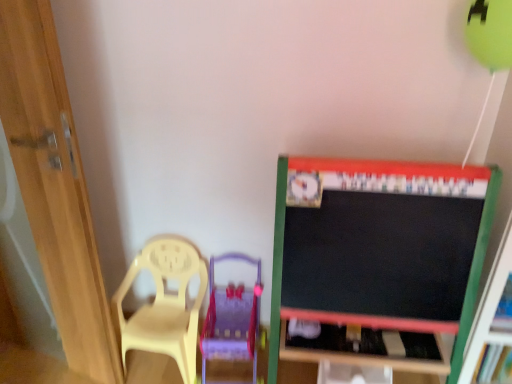
Question: From the image's perspective, relative to wooden door at left, is wooden table at lower center above or below?

Choices:
 (A) below
 (B) above

Answer: (A)

Question: Is wooden table at lower center wider or thinner than wooden door at left?

Choices:
 (A) thin
 (B) wide

Answer: (B)

Question: Which object is the closest to the wooden door at left?

Choices:
 (A) translucent yellow swivel chair at lower left
 (B) yellow plastic chair at left
 (C) wooden table at lower center

Answer: (B)

Question: Based on their relative distances, which object is nearer to the wooden table at lower center?

Choices:
 (A) translucent yellow swivel chair at lower left
 (B) wooden door at left
 (C) yellow plastic chair at left

Answer: (A)